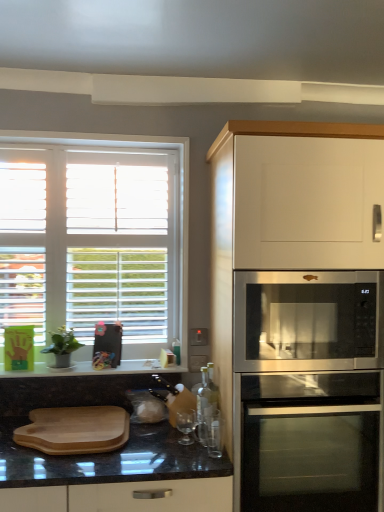
Question: Is the position of wooden cutting board at lower left less distant than that of stainless steel microwave at right?

Choices:
 (A) no
 (B) yes

Answer: (A)

Question: From a real-world perspective, does wooden cutting board at lower left stand above stainless steel microwave at right?

Choices:
 (A) no
 (B) yes

Answer: (A)

Question: Is wooden cutting board at lower left next to stainless steel microwave at right?

Choices:
 (A) yes
 (B) no

Answer: (B)

Question: Is wooden cutting board at lower left bigger than stainless steel microwave at right?

Choices:
 (A) no
 (B) yes

Answer: (A)

Question: Is wooden cutting board at lower left not close to stainless steel microwave at right?

Choices:
 (A) no
 (B) yes

Answer: (A)

Question: From the image's perspective, is stainless steel microwave at right located above or below white matte cabinet at upper right?

Choices:
 (A) below
 (B) above

Answer: (B)

Question: In terms of width, does stainless steel microwave at right look wider or thinner when compared to white matte cabinet at upper right?

Choices:
 (A) wide
 (B) thin

Answer: (B)

Question: In the image, is stainless steel microwave at right positioned in front of or behind white matte cabinet at upper right?

Choices:
 (A) front
 (B) behind

Answer: (B)

Question: From a real-world perspective, relative to white matte cabinet at upper right, is stainless steel microwave at right vertically above or below?

Choices:
 (A) below
 (B) above

Answer: (B)

Question: Looking at their shapes, would you say clear glass at lower center is wider or thinner than wooden cutting board at lower left?

Choices:
 (A) wide
 (B) thin

Answer: (B)

Question: From a real-world perspective, relative to wooden cutting board at lower left, is clear glass at lower center vertically above or below?

Choices:
 (A) below
 (B) above

Answer: (B)

Question: Considering the positions of point (210, 451) and point (89, 442), is point (210, 451) closer or farther from the camera than point (89, 442)?

Choices:
 (A) farther
 (B) closer

Answer: (A)

Question: Relative to wooden cutting board at lower left, is clear glass at lower center in front or behind?

Choices:
 (A) front
 (B) behind

Answer: (B)

Question: Would you say white matte cabinet at upper right is inside or outside white wood window at upper left?

Choices:
 (A) outside
 (B) inside

Answer: (A)

Question: In the image, is white matte cabinet at upper right positioned in front of or behind white wood window at upper left?

Choices:
 (A) behind
 (B) front

Answer: (B)